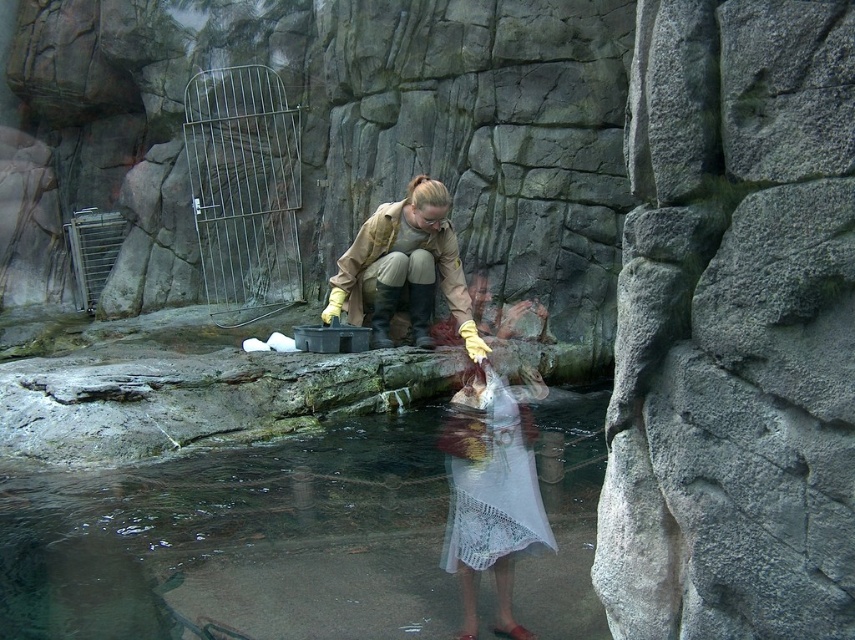
Does brushed metal gate at upper left have a larger size compared to white lace dress at lower center?

Correct, brushed metal gate at upper left is larger in size than white lace dress at lower center.

Can you confirm if brushed metal gate at upper left is positioned to the left of white lace dress at lower center?

Correct, you'll find brushed metal gate at upper left to the left of white lace dress at lower center.

Where is `brushed metal gate at upper left`? This screenshot has width=855, height=640. brushed metal gate at upper left is located at coordinates (245, 189).

Between point (385, 268) and point (522, 500), which one is positioned behind?

Positioned behind is point (385, 268).

Is tan leather jacket at center shorter than white lace dress at lower center?

Incorrect, tan leather jacket at center's height does not fall short of white lace dress at lower center's.

Locate an element on the screen. This screenshot has width=855, height=640. tan leather jacket at center is located at coordinates (405, 269).

Between clear water at lower center and tan leather jacket at center, which one has more height?

With more height is tan leather jacket at center.

Consider the image. Does clear water at lower center lie behind tan leather jacket at center?

No, it is in front of tan leather jacket at center.

Who is more forward, (357, 556) or (441, 216)?

Point (357, 556)

This screenshot has width=855, height=640. Find the location of `clear water at lower center`. clear water at lower center is located at coordinates (239, 541).